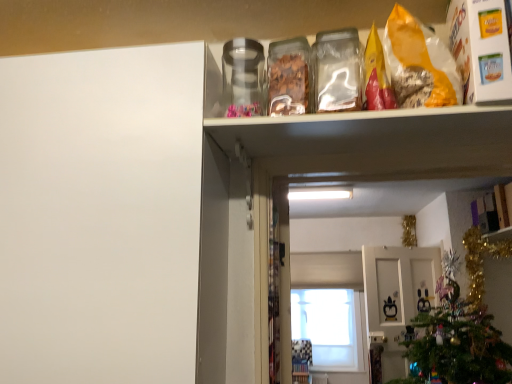
Question: Considering the positions of point (141, 117) and point (488, 215), is point (141, 117) closer or farther from the camera than point (488, 215)?

Choices:
 (A) farther
 (B) closer

Answer: (B)

Question: Considering the positions of white matte cabinet door at left and matte white cabinet at upper right in the image, is white matte cabinet door at left wider or thinner than matte white cabinet at upper right?

Choices:
 (A) thin
 (B) wide

Answer: (B)

Question: Estimate the real-world distances between objects in this image. Which object is farther from the white glossy cabinet doors at center?

Choices:
 (A) white matte cabinet door at left
 (B) yellow paper bag of cereal at upper right
 (C) matte white cabinet at upper right
 (D) transparent glass window at center

Answer: (A)

Question: Considering the real-world distances, which object is closest to the transparent glass window at center?

Choices:
 (A) yellow paper bag of cereal at upper right
 (B) white glossy cabinet doors at center
 (C) white matte cabinet door at left
 (D) matte white cabinet at upper right

Answer: (B)